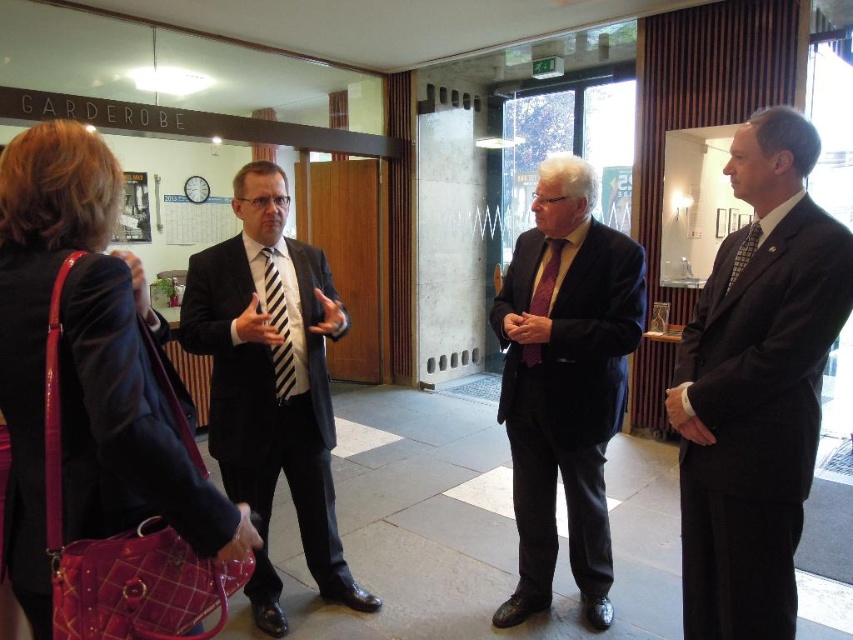
You are a tailor observing the two ties in the image. Which tie, the black striped tie at center or the purple silk tie at center, would you recommend for a client who prefers a more formal look?

The black striped tie at center has a larger size compared to the purple silk tie at center, making it more suitable for a formal occasion where a bold appearance is desired.

You are a photographer setting up for a group photo. You need to ensure that both the black striped tie at center and the purple silk tie at center are visible in the frame. Given their height difference, which tie might require you to adjust your camera angle to avoid being obscured?

The black striped tie at center is much taller than the purple silk tie at center, so the photographer might need to adjust the camera angle to ensure the purple silk tie at center isn not obscured by the taller black striped tie at center.

You are a photographer trying to capture a closeup of the black striped tie at center without the purple silk tie at center appearing in the background. Is this possible based on their positions?

Yes, since the black striped tie at center is in front of the purple silk tie at center, you can focus on the black striped tie at center and exclude the purple silk tie at center from the background by adjusting the camera angle or depth of field.